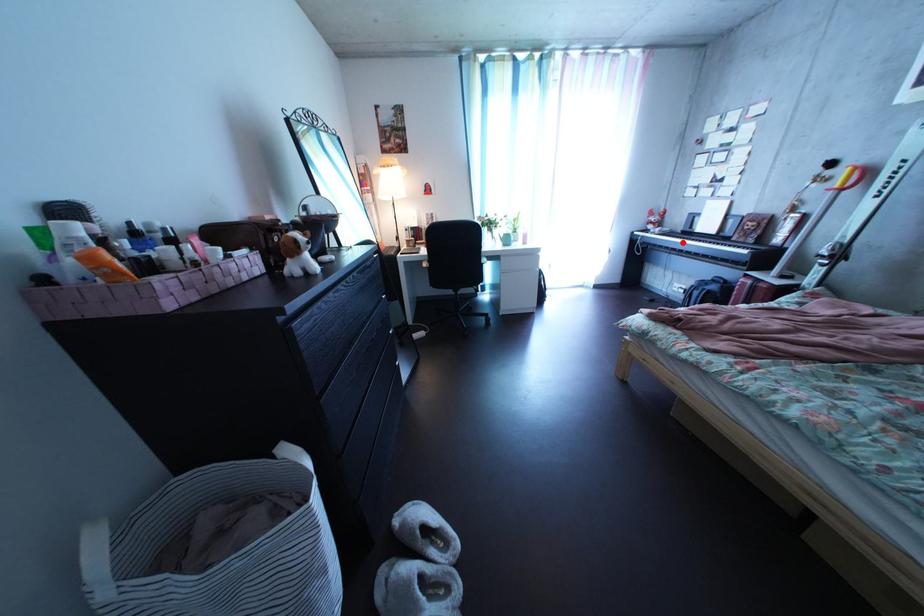
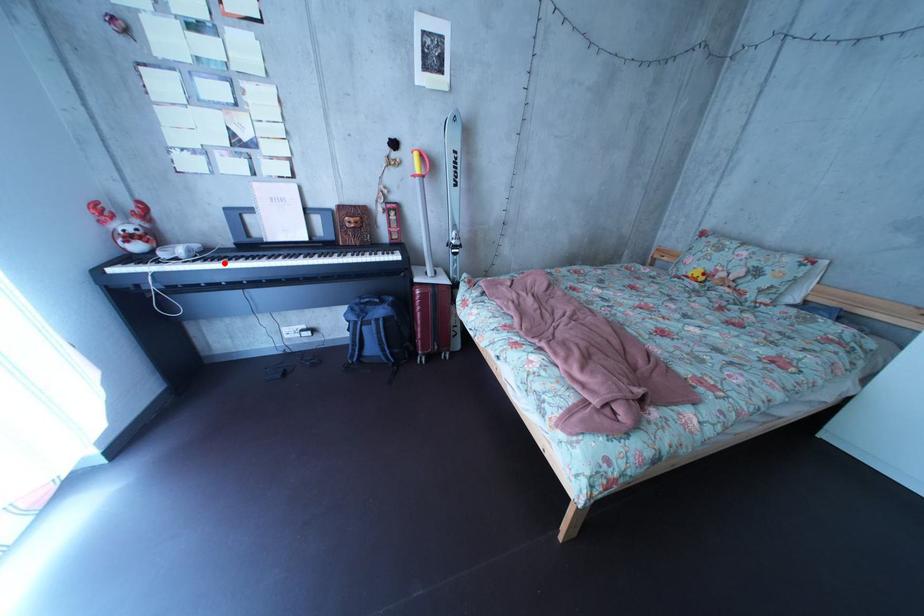
I am providing you with two images of the same scene from different viewpoints. A red point is marked on the first image and another point is marked on the second image. Do the highlighted points in image1 and image2 indicate the same real-world spot?

Yes